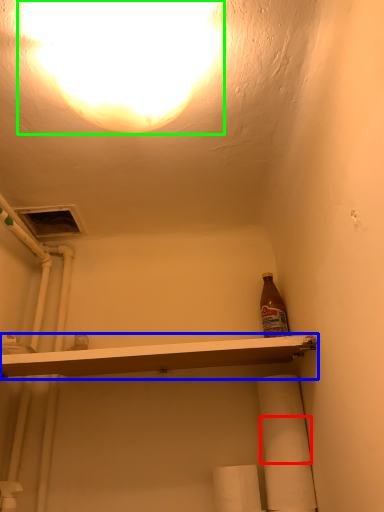
Question: Considering the real-world distances, which object is farthest from toilet paper (highlighted by a red box)? shelf (highlighted by a blue box) or light (highlighted by a green box)?

Choices:
 (A) shelf
 (B) light

Answer: (B)